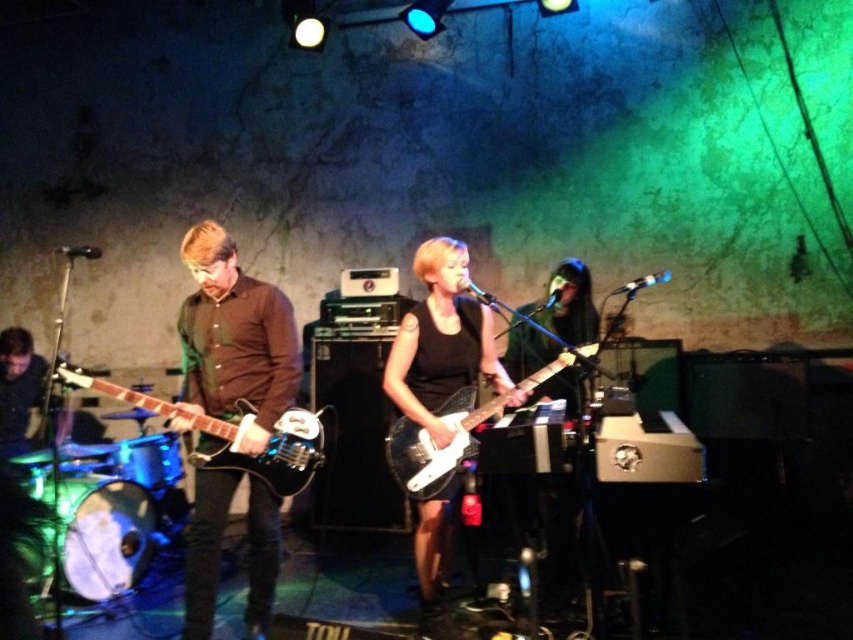
Which is more to the right, glossy black electric guitar at left or white glossy electric guitar at center?

white glossy electric guitar at center is more to the right.

The height and width of the screenshot is (640, 853). What do you see at coordinates (234, 435) in the screenshot? I see `glossy black electric guitar at left` at bounding box center [234, 435].

Where is `glossy black electric guitar at left`? glossy black electric guitar at left is located at coordinates (234, 435).

Which is in front, point (430, 541) or point (120, 392)?

Point (120, 392) is in front.

Which is above, black matte guitar at center or glossy black electric guitar at left?

glossy black electric guitar at left is above.

Is point (447, 365) positioned in front of point (224, 456)?

No, it is not.

The image size is (853, 640). I want to click on black matte guitar at center, so click(x=444, y=340).

Which is behind, point (190, 257) or point (468, 426)?

The point (468, 426) is more distant.

Which is more to the left, matte brown shirt at center or white glossy electric guitar at center?

Positioned to the left is matte brown shirt at center.

Does point (265, 410) come in front of point (418, 428)?

Yes, point (265, 410) is in front of point (418, 428).

This screenshot has height=640, width=853. I want to click on matte brown shirt at center, so click(x=234, y=337).